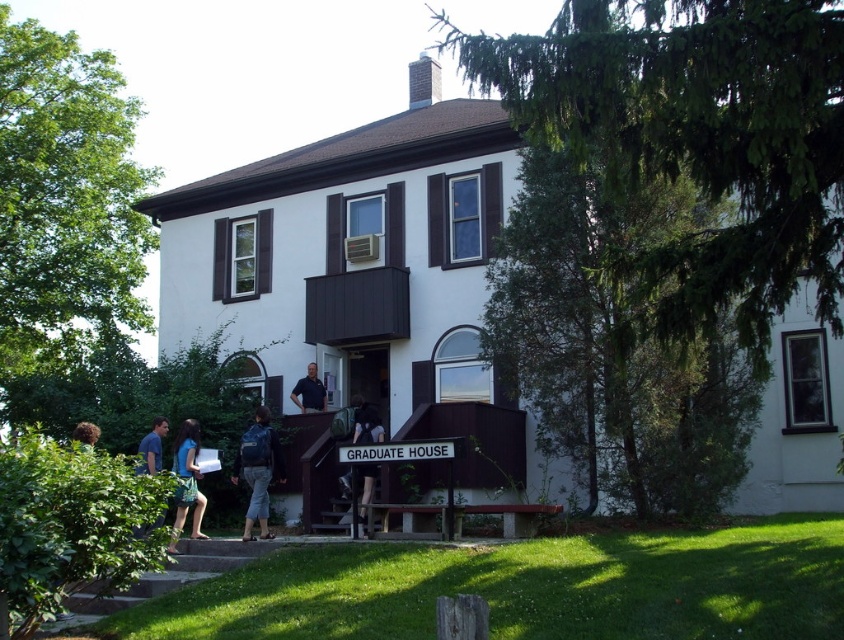
You are standing in front of the GRADUATE HOUSE and notice two points marked on the building. Which point, point (258,465) or point (139,467), is closer to you?

Point (258,465) is closer to you because it is further to the viewer than point (139,467).

In the scene shown: You are standing at the entrance of the GRADUATE HOUSE and need to find the dark blue backpack at center. According to the scene description, where exactly is the dark blue backpack positioned relative to the entrance?

The dark blue backpack at center is located at point coordinates 0.667 along the horizontal axis and 0.436 along the vertical axis relative to the entrance.